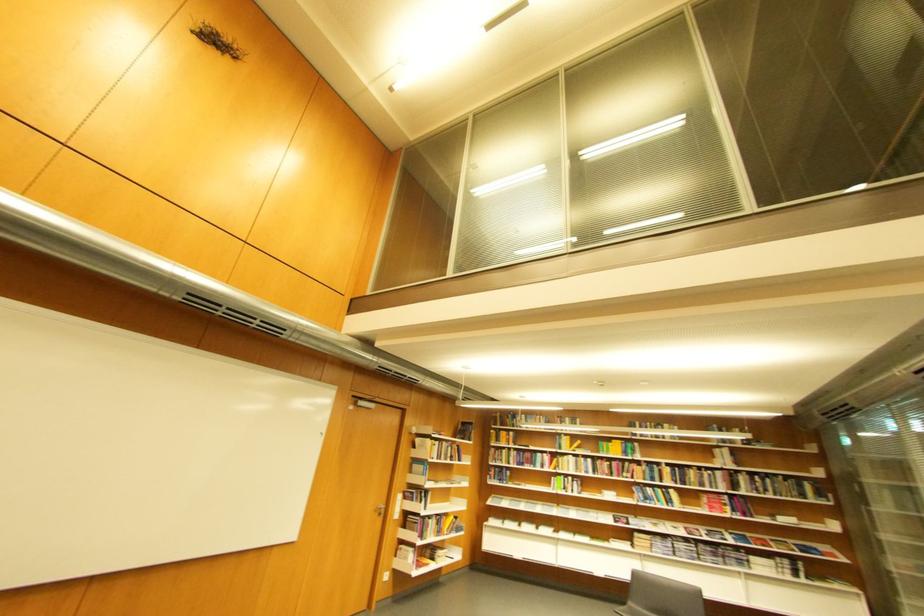
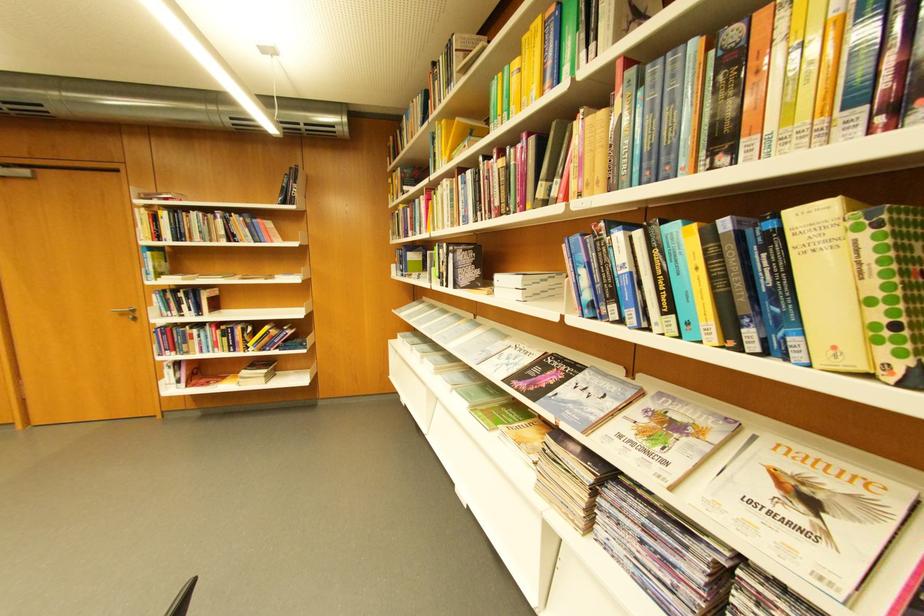
In the second image, find the point that corresponds to pixel 576 490 in the first image.

(451, 278)